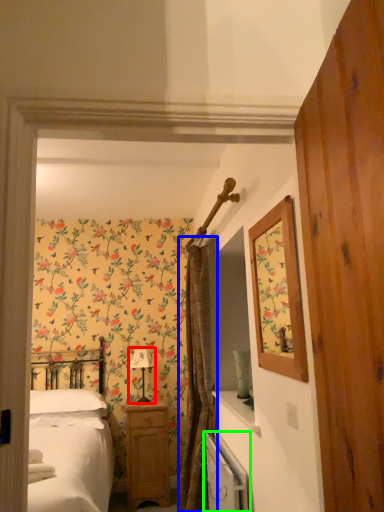
Question: Which is nearer to the table lamp (highlighted by a red box)? curtain (highlighted by a blue box) or radiator (highlighted by a green box).

Choices:
 (A) curtain
 (B) radiator

Answer: (A)